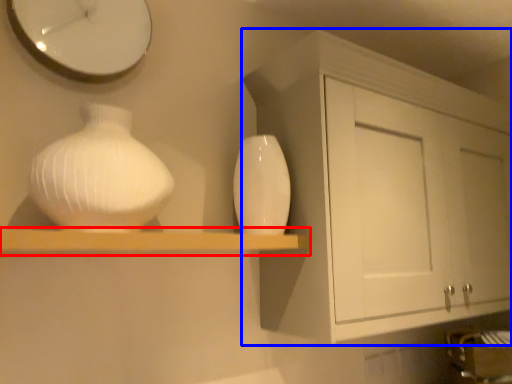
Question: Which object is closer to the camera taking this photo, shelf (highlighted by a red box) or cabinetry (highlighted by a blue box)?

Choices:
 (A) shelf
 (B) cabinetry

Answer: (A)